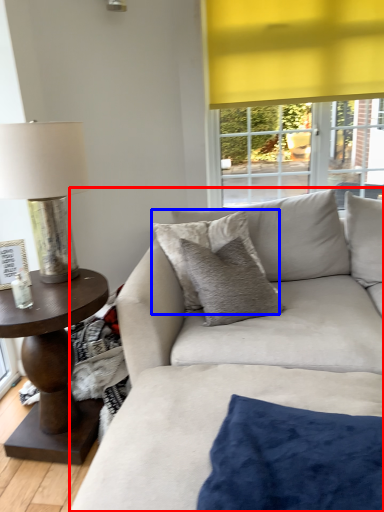
Question: Which object appears closest to the camera in this image, studio couch (highlighted by a red box) or pillow (highlighted by a blue box)?

Choices:
 (A) studio couch
 (B) pillow

Answer: (A)